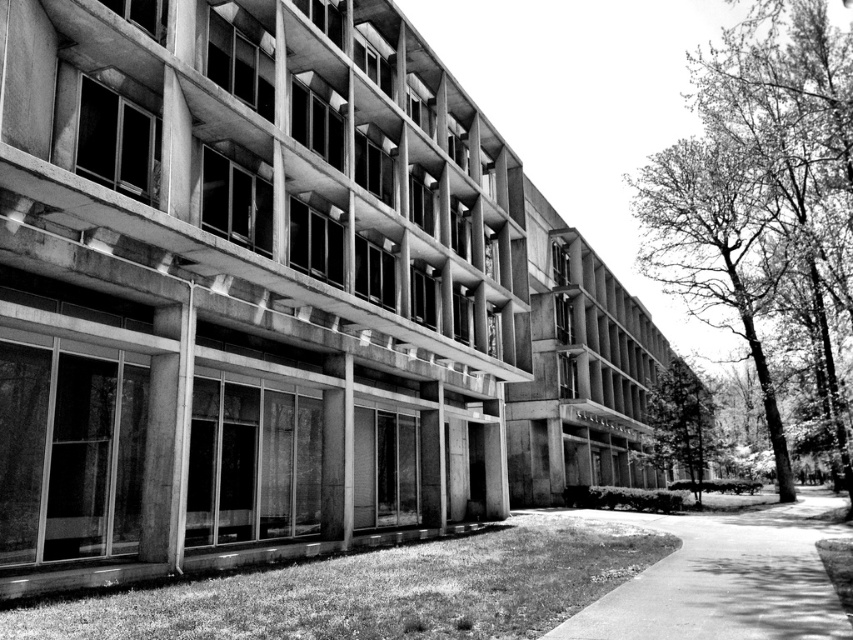
You are a landscape architect designing a new garden. You need to place a statue that is 3 meters tall. Given the smooth bark tree at right and the smooth concrete path at center in the scene, which object would be more suitable as a reference point for the statue placement to ensure proper scale?

The smooth bark tree at right is taller than the smooth concrete path at center, so using the tree as a reference point would help ensure the statue is appropriately scaled since the tree provides a vertical reference.